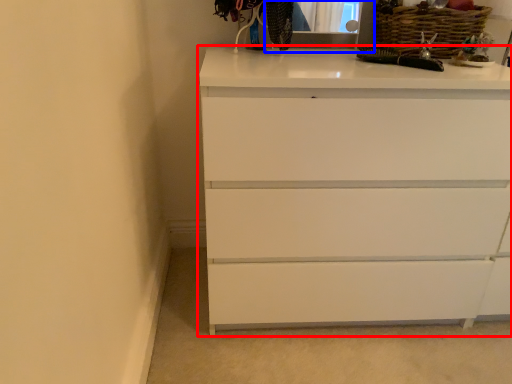
Question: Among these objects, which one is farthest to the camera, chest of drawers (highlighted by a red box) or medicine cabinet (highlighted by a blue box)?

Choices:
 (A) chest of drawers
 (B) medicine cabinet

Answer: (B)